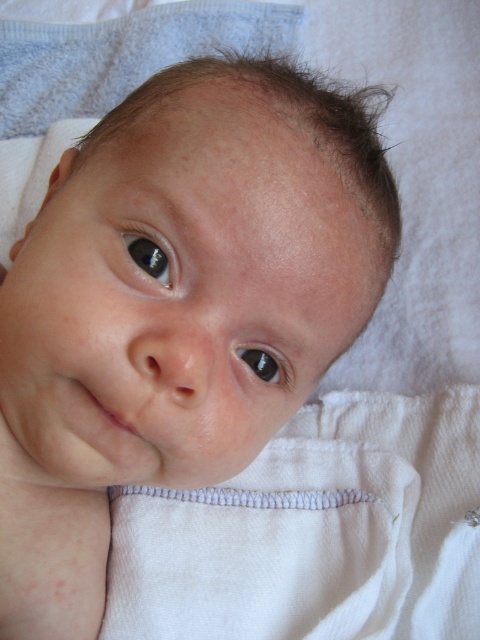
Question: Among these points, which one is nearest to the camera?

Choices:
 (A) (131, 250)
 (B) (263, 376)

Answer: (A)

Question: Can you confirm if black glossy eye at upper left is thinner than black glossy eye at center?

Choices:
 (A) yes
 (B) no

Answer: (A)

Question: Is black glossy eye at upper left wider than black glossy eye at center?

Choices:
 (A) no
 (B) yes

Answer: (A)

Question: Observing the image, what is the correct spatial positioning of black glossy eye at upper left in reference to black glossy eye at center?

Choices:
 (A) left
 (B) right

Answer: (A)

Question: Among these objects, which one is nearest to the camera?

Choices:
 (A) black glossy eye at center
 (B) black glossy eye at upper left

Answer: (B)